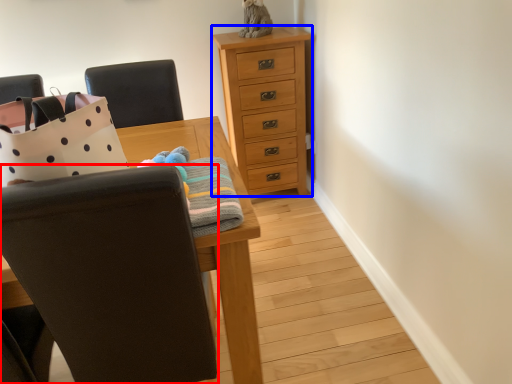
Question: Among these objects, which one is farthest to the camera, chair (highlighted by a red box) or chest of drawers (highlighted by a blue box)?

Choices:
 (A) chair
 (B) chest of drawers

Answer: (B)